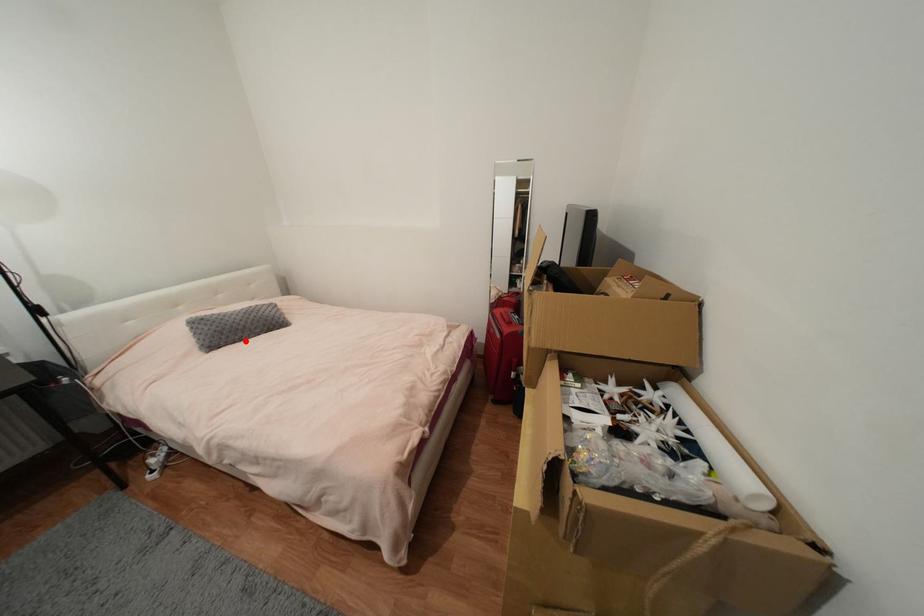
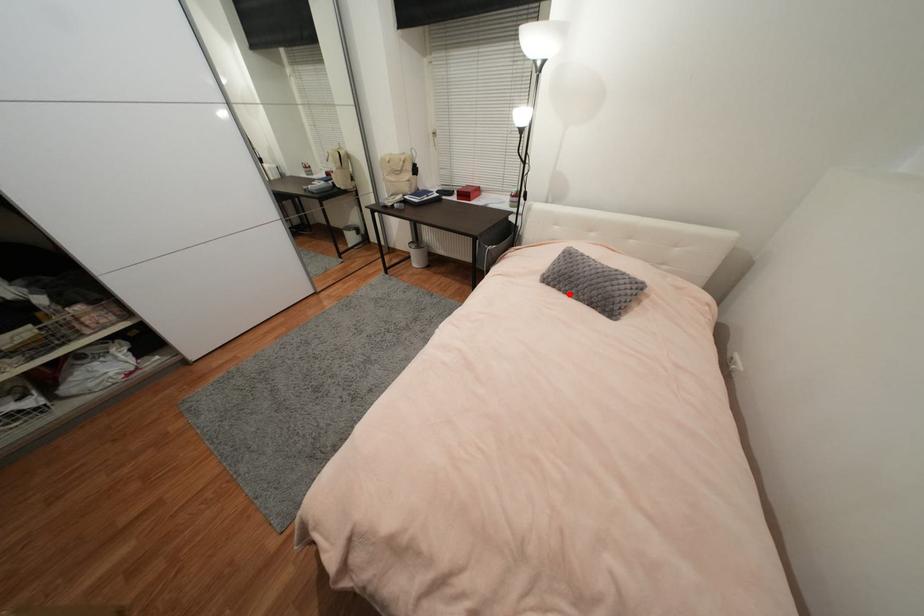
I am providing you with two images of the same scene from different viewpoints. A red point is marked on the first image and another point is marked on the second image. Is the red point in image1 aligned with the point shown in image2?

Yes